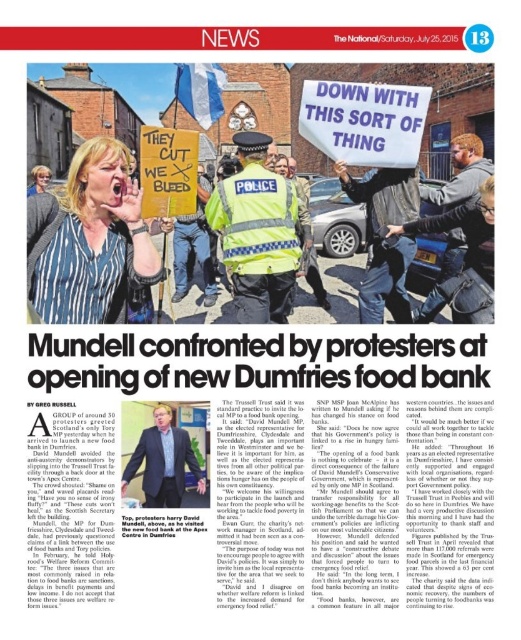
You are a journalist analyzing the protest photo. The white fabric banner at upper center and the blonde hair at upper left are both visible in the image. Which object is positioned to the right of the other?

The white fabric banner at upper center is to the right of blonde hair at upper left.

Based on the scene described, where is the reflective blue vest at center located in relation to the protesters holding signs?

The reflective blue vest at center is located at point (258, 232), which is centrally positioned among the protesters holding signs.

You are a photographer standing at the camera position. There is a white fabric banner at upper center in the scene. If you want to capture a closeup of the banner without moving the camera, what adjustment should you make to your camera settings?

To capture a closeup of the white fabric banner at upper center without moving the camera, you should zoom in using the lens. The banner is 38.02 meters away from the camera, so adjusting the zoom will allow you to magnify the image of the banner without physically moving closer.